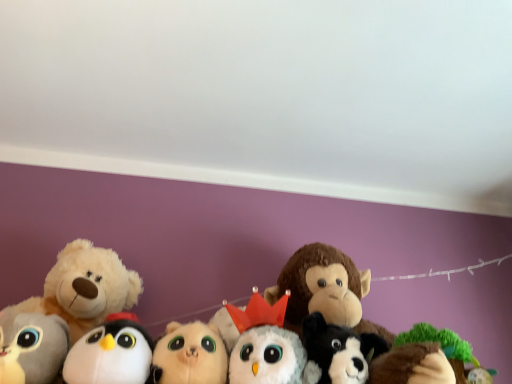
Question: Should I look upward or downward to see white plush dog at center, the 6th toy from the left?

Choices:
 (A) down
 (B) up

Answer: (A)

Question: Can you confirm if green plush tree at lower right, arranged as the seventh toy when viewed from the left, is thinner than fluffy beige cat at center, which is counted as the 4th toy, starting from the left?

Choices:
 (A) no
 (B) yes

Answer: (B)

Question: Would you say green plush tree at lower right, acting as the 1th toy starting from the right, is outside fluffy beige cat at center, which is counted as the 4th toy, starting from the left?

Choices:
 (A) no
 (B) yes

Answer: (B)

Question: Does green plush tree at lower right, acting as the 1th toy starting from the right, have a greater width compared to fluffy beige cat at center, acting as the 4th toy starting from the right?

Choices:
 (A) yes
 (B) no

Answer: (B)

Question: From the image's perspective, would you say green plush tree at lower right, arranged as the seventh toy when viewed from the left, is shown under fluffy beige cat at center, acting as the 4th toy starting from the right?

Choices:
 (A) no
 (B) yes

Answer: (A)

Question: From the image's perspective, is green plush tree at lower right, arranged as the seventh toy when viewed from the left, on fluffy beige cat at center, which is counted as the 4th toy, starting from the left?

Choices:
 (A) yes
 (B) no

Answer: (A)

Question: Is green plush tree at lower right, acting as the 1th toy starting from the right, further to the viewer compared to fluffy beige cat at center, which is counted as the 4th toy, starting from the left?

Choices:
 (A) yes
 (B) no

Answer: (A)

Question: Considering the relative sizes of white plush owl at center, the 5th toy when ordered from left to right, and fluffy white teddy bear at left, the second toy from the left, in the image provided, is white plush owl at center, the 5th toy when ordered from left to right, smaller than fluffy white teddy bear at left, the second toy from the left,?

Choices:
 (A) no
 (B) yes

Answer: (B)

Question: Does white plush owl at center, which is the third toy in right-to-left order, come behind fluffy white teddy bear at left, the second toy from the left?

Choices:
 (A) yes
 (B) no

Answer: (A)

Question: Is white plush owl at center, the 5th toy when ordered from left to right, wider than fluffy white teddy bear at left, arranged as the sixth toy when viewed from the right?

Choices:
 (A) yes
 (B) no

Answer: (B)

Question: From a real-world perspective, does white plush owl at center, which is the third toy in right-to-left order, stand above fluffy white teddy bear at left, arranged as the sixth toy when viewed from the right?

Choices:
 (A) no
 (B) yes

Answer: (A)

Question: Is white plush owl at center, which is the third toy in right-to-left order, bigger than fluffy white teddy bear at left, arranged as the sixth toy when viewed from the right?

Choices:
 (A) no
 (B) yes

Answer: (A)

Question: Considering the relative sizes of white plush owl at center, which is the third toy in right-to-left order, and fluffy white teddy bear at left, the second toy from the left, in the image provided, is white plush owl at center, which is the third toy in right-to-left order, shorter than fluffy white teddy bear at left, the second toy from the left,?

Choices:
 (A) yes
 (B) no

Answer: (A)

Question: Is white plush penguin at lower left, placed as the 3th toy when sorted from left to right, next to green plush tree at lower right, arranged as the seventh toy when viewed from the left?

Choices:
 (A) yes
 (B) no

Answer: (B)